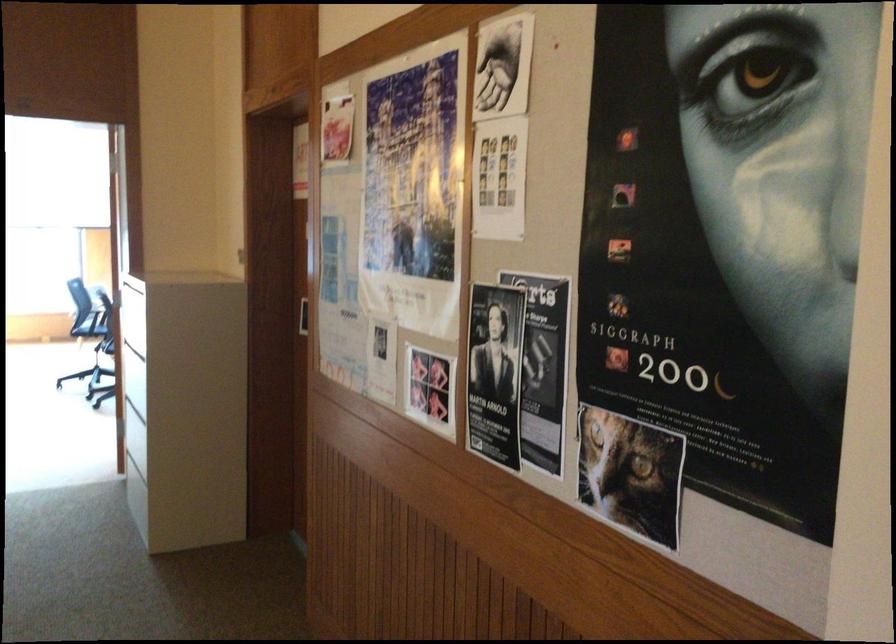
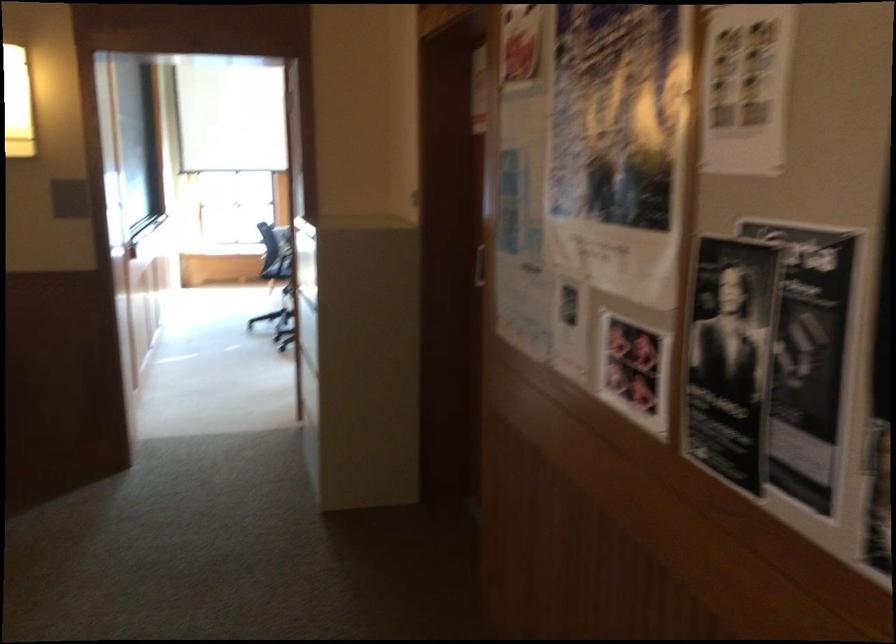
Question: How did the camera likely rotate?

Choices:
 (A) Left
 (B) Right
 (C) Up
 (D) Down

Answer: (A)